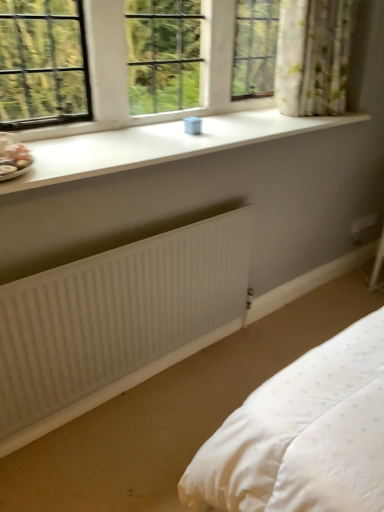
Image resolution: width=384 pixels, height=512 pixels. What are the coordinates of `vacant space behind matte pink porcelain at left` in the screenshot? It's located at (42, 148).